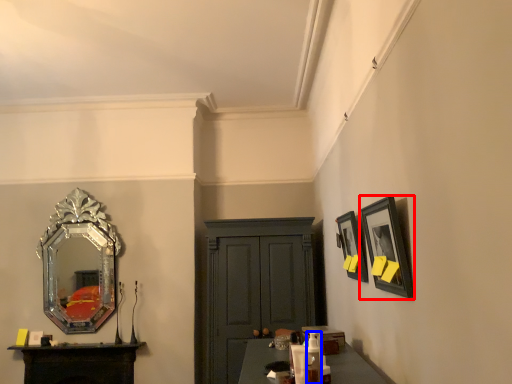
Question: Which point is further to the camera, picture frame (highlighted by a red box) or toiletry (highlighted by a blue box)?

Choices:
 (A) picture frame
 (B) toiletry

Answer: (B)